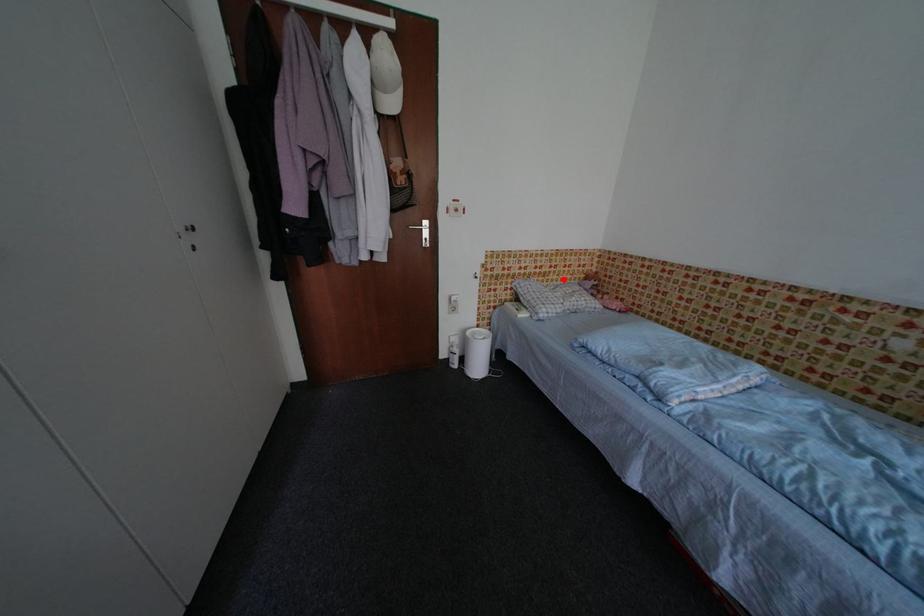
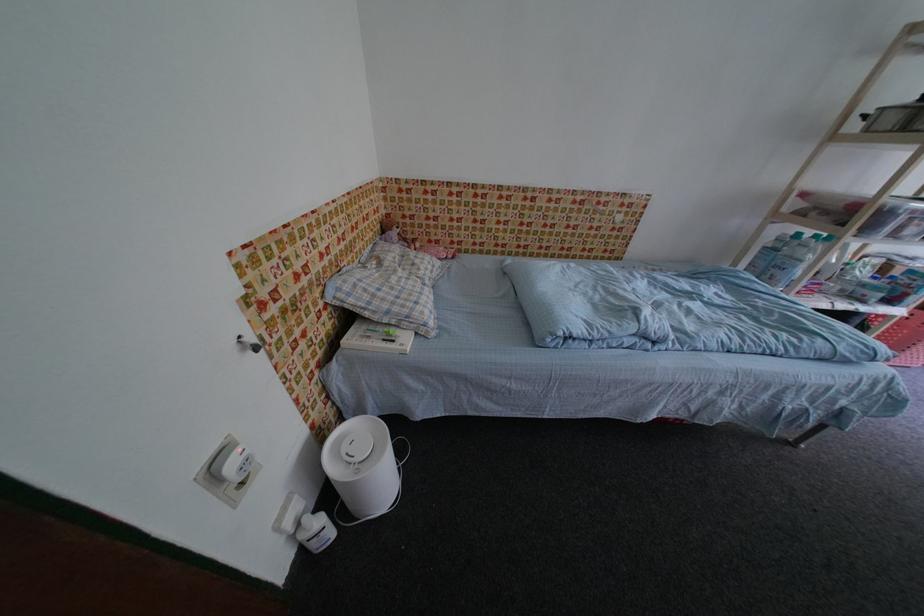
Find the pixel in the second image that matches the highlighted location in the first image.

(370, 246)